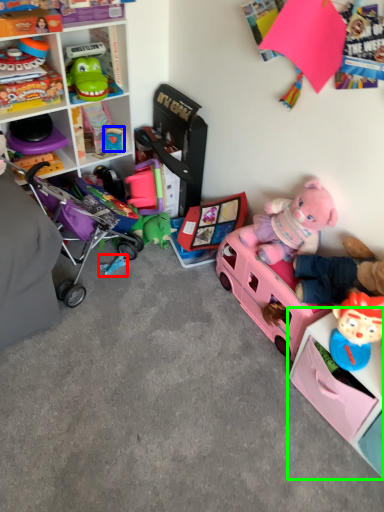
Question: Which object is positioned farthest from toy (highlighted by a red box)? Select from toy (highlighted by a blue box) and shelf (highlighted by a green box).

Choices:
 (A) toy
 (B) shelf

Answer: (B)